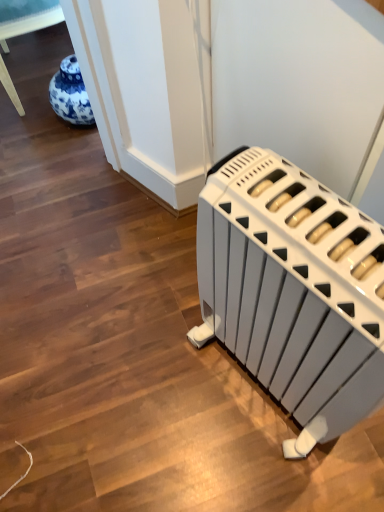
Where is `vacant area to the left of white plastic heater at lower right`? vacant area to the left of white plastic heater at lower right is located at coordinates (160, 388).